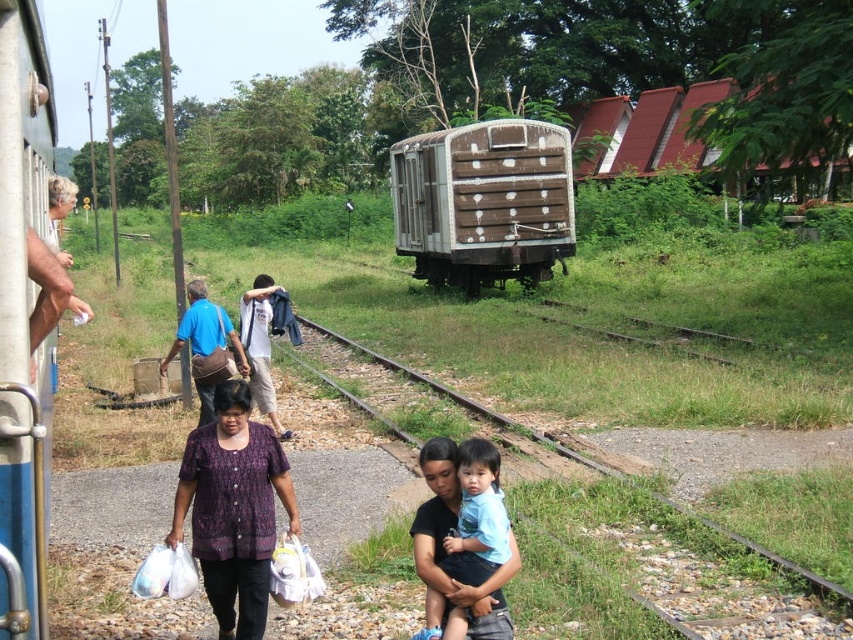
You are a traveler who just arrived at the train station and see the brown wooden train at center and the blue fabric bag at center. Which object is taller?

The brown wooden train at center is taller than the blue fabric bag at center.

You are standing at the point closer to the camera in this railway scene. Which point are you at, point (502, 132) or point (209, 333)?

You are at point (502, 132) because it is further to the camera than point (209, 333). Since you are standing at the point closer to the camera, you must be at the point that is closer. Wait, there is a contradiction here. Let me recheck the description. The description says point (502, 132) is further to the camera than point (209, 333). So if you are at the closer point, you must be at point (209, 333).